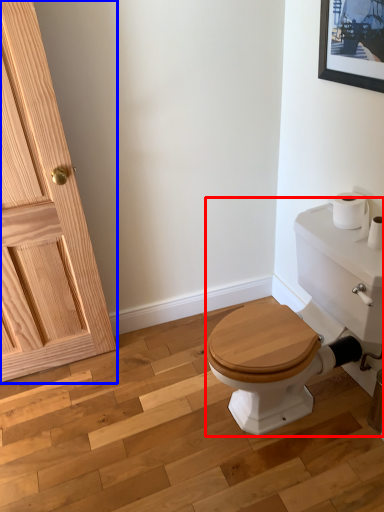
Question: Which object appears farthest to the camera in this image, porcelain (highlighted by a red box) or door (highlighted by a blue box)?

Choices:
 (A) porcelain
 (B) door

Answer: (B)